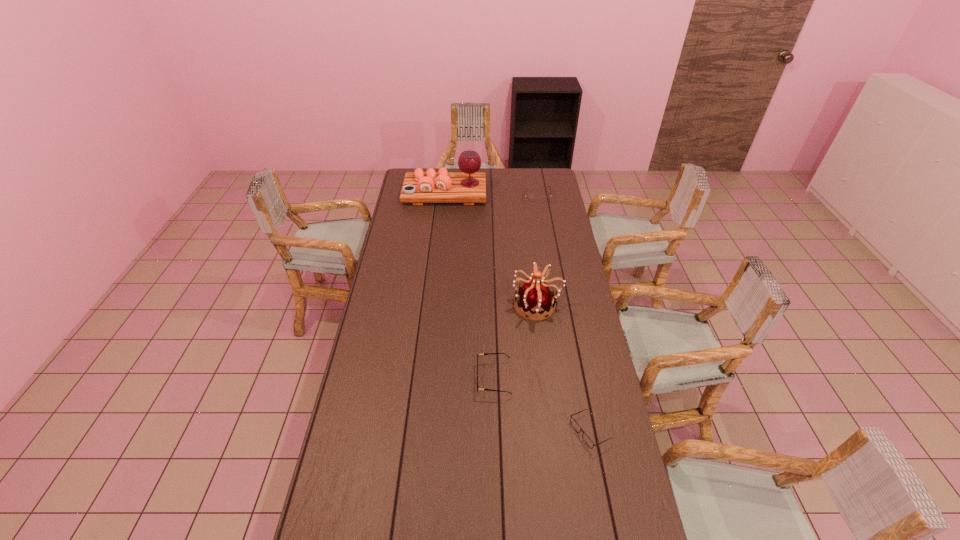
You are a GUI agent. You are given a task and a screenshot of the screen. Output one action in this format:
    pyautogui.click(x=<x>, y=<y>)
    Task: Click on the vacant region located on the front-facing side of the farthest spectacles
    This screenshot has width=960, height=540.
    Given the screenshot: What is the action you would take?
    pyautogui.click(x=541, y=226)

The height and width of the screenshot is (540, 960). I want to click on free space located on the front-facing side of the fourth farthest object, so click(372, 379).

The width and height of the screenshot is (960, 540). I want to click on vacant space situated on the front-facing side of the fourth farthest object, so click(x=417, y=379).

Identify the location of vacant space located 0.200m on the front-facing side of the fourth farthest object. The width and height of the screenshot is (960, 540). (421, 379).

Find the location of a particular element. Image resolution: width=960 pixels, height=540 pixels. blank space located 0.270m with the lenses facing outward on the nearest object is located at coordinates (489, 431).

What are the coordinates of `blank area located 0.310m with the lenses facing outward on the nearest object` in the screenshot? It's located at click(x=476, y=431).

The height and width of the screenshot is (540, 960). What are the coordinates of `vacant region located 0.280m with the lenses facing outward on the nearest object` in the screenshot? It's located at (486, 431).

The image size is (960, 540). Identify the location of platter at the far edge. (468, 186).

The image size is (960, 540). I want to click on spectacles at the far edge, so click(530, 199).

At what (x,y) coordinates should I click in order to perform the action: click on object situated at the left edge. Please return your answer as a coordinate pair (x, y). Image resolution: width=960 pixels, height=540 pixels. Looking at the image, I should click on (468, 186).